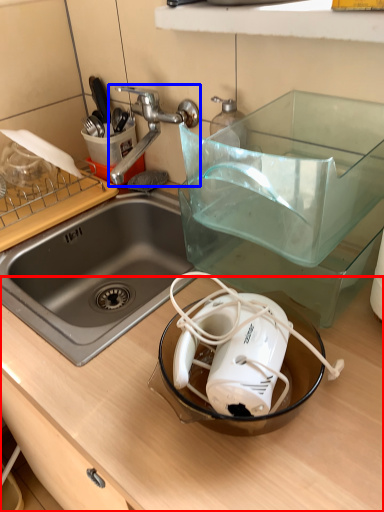
Question: Which object appears farthest to the camera in this image, counter top (highlighted by a red box) or tap (highlighted by a blue box)?

Choices:
 (A) counter top
 (B) tap

Answer: (B)